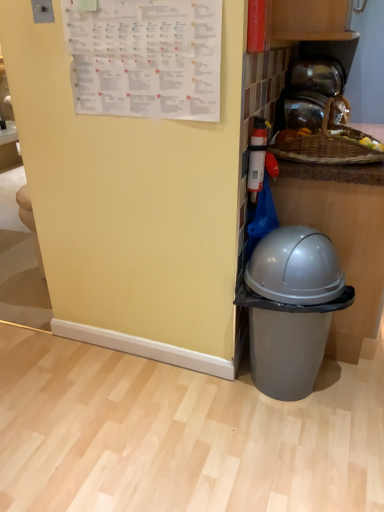
You are a GUI agent. You are given a task and a screenshot of the screen. Output one action in this format:
    pyautogui.click(x=<x>, y=<y>)
    Task: Click on the vacant area that is in front of gray plastic trash can at lower right
    The height and width of the screenshot is (512, 384).
    Given the screenshot: What is the action you would take?
    pyautogui.click(x=301, y=452)